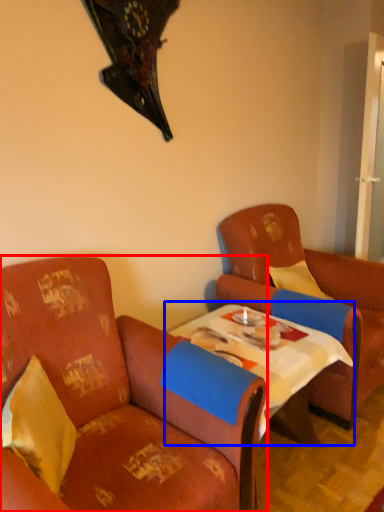
Question: Which object appears farthest to the camera in this image, chair (highlighted by a red box) or table (highlighted by a blue box)?

Choices:
 (A) chair
 (B) table

Answer: (B)